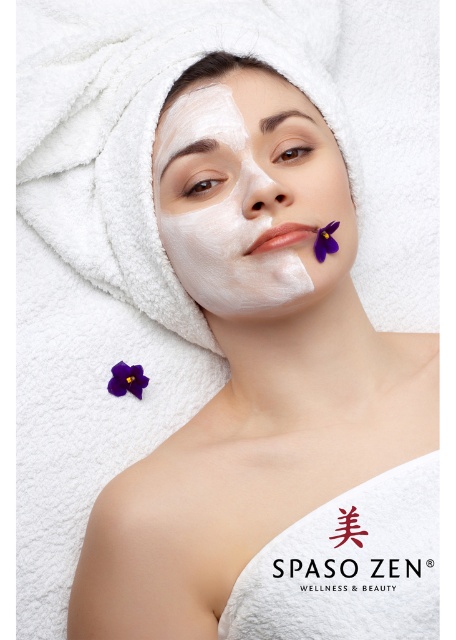
Question: Is purple matte flower at upper center to the right of purple matte flower at upper right from the viewer's perspective?

Choices:
 (A) no
 (B) yes

Answer: (A)

Question: Is white matte facial mask at center to the right of purple matte flower at upper right from the viewer's perspective?

Choices:
 (A) no
 (B) yes

Answer: (A)

Question: Estimate the real-world distances between objects in this image. Which object is farther from the white matte facial mask at center?

Choices:
 (A) purple matte flower at upper center
 (B) purple matte flower at upper right

Answer: (A)

Question: Which of the following is the closest to the observer?

Choices:
 (A) purple matte flower at upper center
 (B) white matte facial mask at center
 (C) purple matte flower at upper right

Answer: (B)

Question: Does white matte facial mask at center have a greater width compared to purple matte flower at upper center?

Choices:
 (A) no
 (B) yes

Answer: (B)

Question: Estimate the real-world distances between objects in this image. Which object is closer to the purple matte flower at upper right?

Choices:
 (A) white matte facial mask at center
 (B) purple matte flower at upper center

Answer: (A)